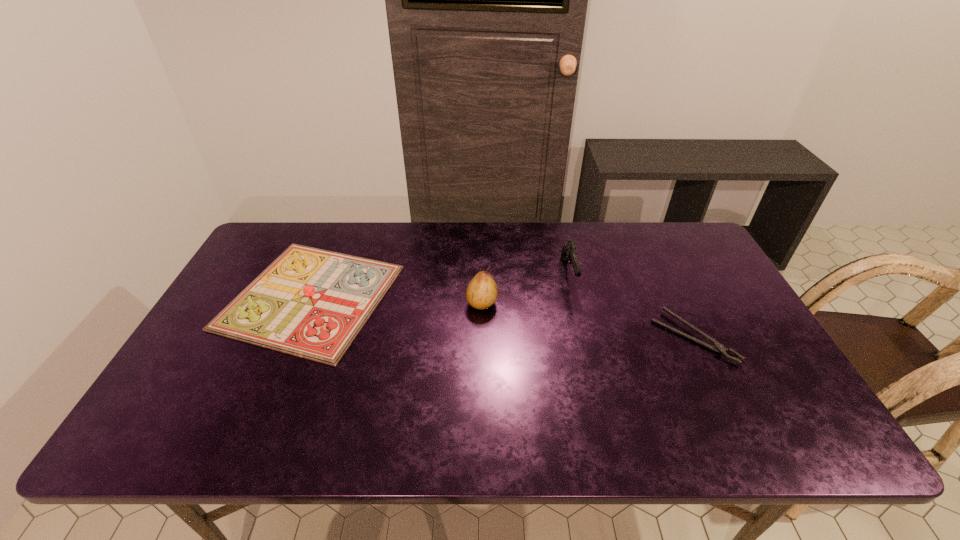
Locate an element on the screen. The height and width of the screenshot is (540, 960). the closest object to the second object from right to left is located at coordinates (719, 348).

Locate an element on the screen. The image size is (960, 540). object that can be found as the second closest to the gun is located at coordinates (482, 292).

The image size is (960, 540). In order to click on free spot that satisfies the following two spatial constraints: 1. on the front side of the second object from left to right; 2. on the right side of the shortest object in this screenshot , I will do `click(482, 337)`.

Identify the location of free space that satisfies the following two spatial constraints: 1. at the end of the barrel of the tongs; 2. on the right side of the gun. This screenshot has height=540, width=960. (584, 337).